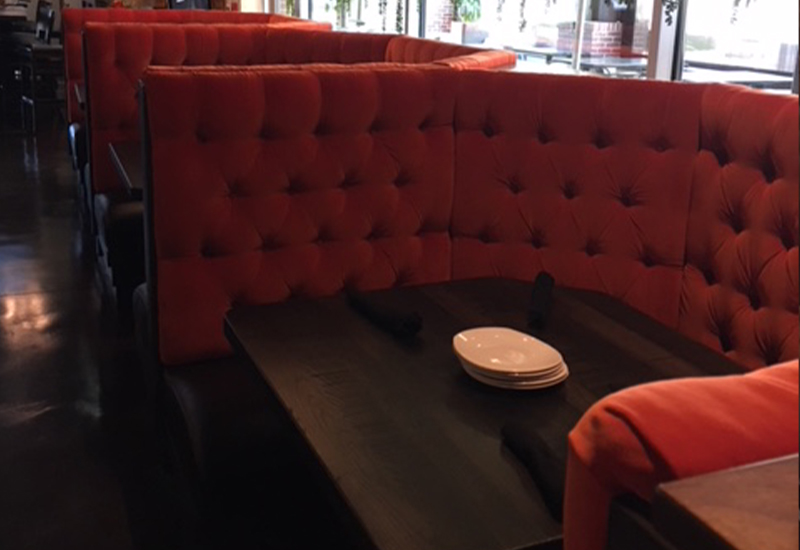
Identify the location of windows. (370, 9).